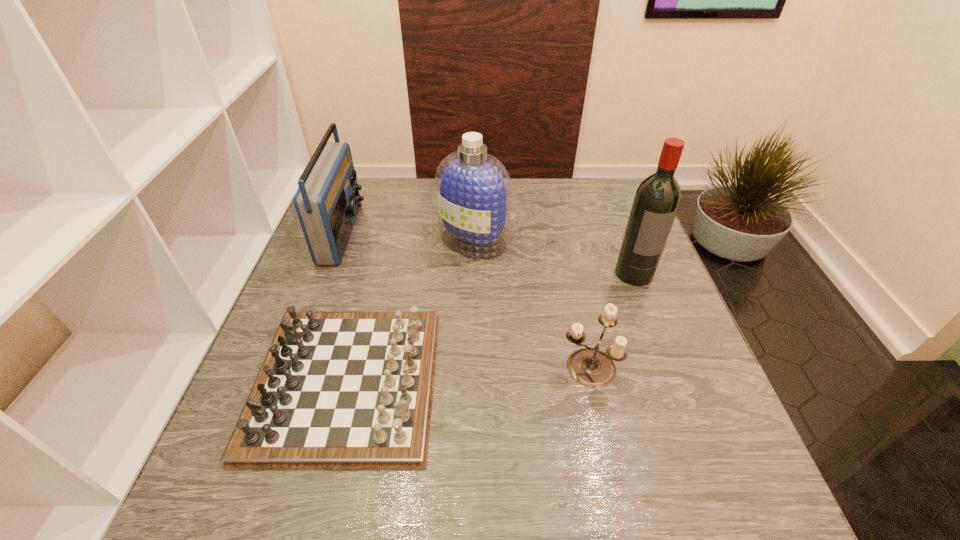
Locate an element on the screen. This screenshot has height=540, width=960. vacant space that's between the chessboard and the cleansing agent is located at coordinates (410, 311).

Choose which object is the fourth nearest neighbor to the chessboard. Please provide its 2D coordinates. Your answer should be formatted as a tuple, i.e. [(x, y)], where the tuple contains the x and y coordinates of a point satisfying the conditions above.

[(657, 198)]

The width and height of the screenshot is (960, 540). I want to click on the third closest object to the shortest object, so click(x=589, y=366).

Identify the location of vacant space that satisfies the following two spatial constraints: 1. on the front panel of the candle holder; 2. on the left side of the radio receiver. The width and height of the screenshot is (960, 540). (293, 367).

Find the location of a particular element. vacant space that satisfies the following two spatial constraints: 1. on the label of the wine bottle; 2. from the player's perspective of the chessboard is located at coordinates (675, 382).